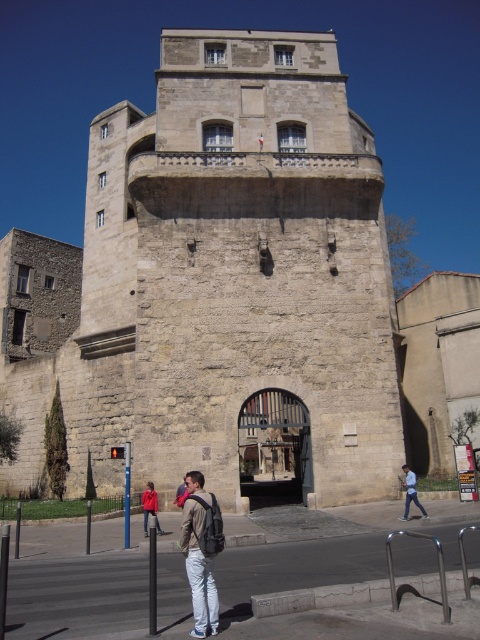
Question: Which point is farther to the camera?

Choices:
 (A) (139, 358)
 (B) (412, 472)
 (C) (193, 556)
 (D) (159, 532)

Answer: (B)

Question: Which point is farther to the camera?

Choices:
 (A) (408, 493)
 (B) (249, 355)
 (C) (144, 534)

Answer: (B)

Question: Is stone tower at center thinner than light brown backpack at center?

Choices:
 (A) yes
 (B) no

Answer: (B)

Question: Estimate the real-world distances between objects in this image. Which object is closer to the light brown backpack at center?

Choices:
 (A) red fabric jacket at center
 (B) light blue jeans at lower right

Answer: (A)

Question: Is stone tower at center to the right of light brown backpack at center from the viewer's perspective?

Choices:
 (A) yes
 (B) no

Answer: (B)

Question: Is light brown backpack at center positioned at the back of light blue jeans at lower right?

Choices:
 (A) no
 (B) yes

Answer: (A)